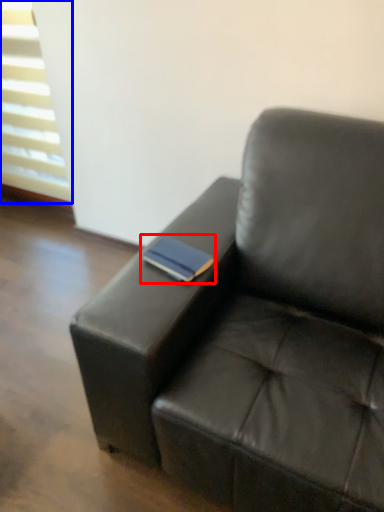
Question: Among these objects, which one is farthest to the camera, paperback book (highlighted by a red box) or window (highlighted by a blue box)?

Choices:
 (A) paperback book
 (B) window

Answer: (B)